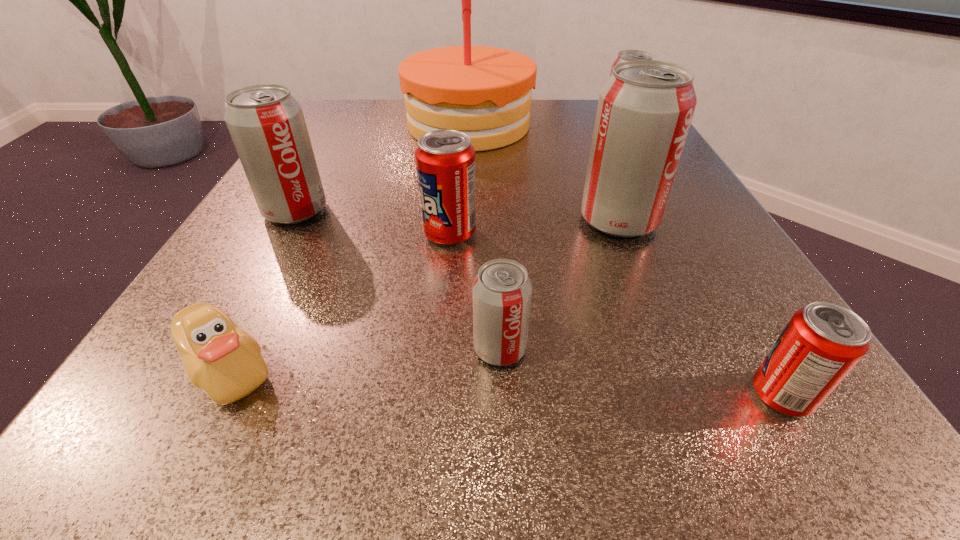
Find the location of a particular element. The height and width of the screenshot is (540, 960). the smaller red soda can is located at coordinates (822, 342).

This screenshot has width=960, height=540. Find the location of `the nearest soda can`. the nearest soda can is located at coordinates (822, 342).

Find the location of a particular element. This screenshot has width=960, height=540. the second nearest soda can is located at coordinates (502, 291).

You are a GUI agent. You are given a task and a screenshot of the screen. Output one action in this format:
    pyautogui.click(x=<x>, y=<y>)
    Task: Click on the smallest gray soda can
    The image size is (960, 540).
    Given the screenshot: What is the action you would take?
    (502, 291)

Identify the location of duck. The height and width of the screenshot is (540, 960). (220, 358).

This screenshot has width=960, height=540. I want to click on free space located on the left of the orange birthday cake, so click(x=335, y=125).

Where is `vacant space located 0.100m on the back of the tallest soda can`? This screenshot has width=960, height=540. vacant space located 0.100m on the back of the tallest soda can is located at coordinates (598, 172).

I want to click on vacant area located 0.240m on the right of the second tallest soda can, so click(469, 211).

The height and width of the screenshot is (540, 960). I want to click on blank area located on the front of the third biggest gray soda can, so click(676, 230).

The image size is (960, 540). Find the location of `free point located 0.060m on the right of the bigger red soda can`. free point located 0.060m on the right of the bigger red soda can is located at coordinates (514, 233).